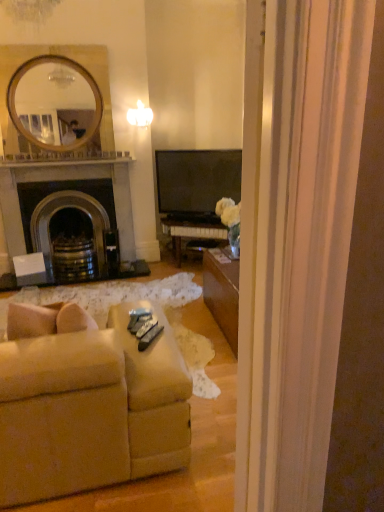
Question: Looking at the image, does beige fabric couch at lower left seem bigger or smaller compared to dark gray stone fireplace at left?

Choices:
 (A) small
 (B) big

Answer: (B)

Question: Does point (190, 417) appear closer or farther from the camera than point (127, 231)?

Choices:
 (A) closer
 (B) farther

Answer: (A)

Question: Is beige fabric couch at lower left spatially inside dark gray stone fireplace at left, or outside of it?

Choices:
 (A) outside
 (B) inside

Answer: (A)

Question: Relative to beige fabric couch at lower left, is dark gray stone fireplace at left in front or behind?

Choices:
 (A) front
 (B) behind

Answer: (B)

Question: Considering the positions of dark gray stone fireplace at left and beige fabric couch at lower left in the image, is dark gray stone fireplace at left taller or shorter than beige fabric couch at lower left?

Choices:
 (A) tall
 (B) short

Answer: (A)

Question: Considering the positions of dark gray stone fireplace at left and beige fabric couch at lower left in the image, is dark gray stone fireplace at left wider or thinner than beige fabric couch at lower left?

Choices:
 (A) wide
 (B) thin

Answer: (B)

Question: Is dark gray stone fireplace at left spatially inside beige fabric couch at lower left, or outside of it?

Choices:
 (A) outside
 (B) inside

Answer: (A)